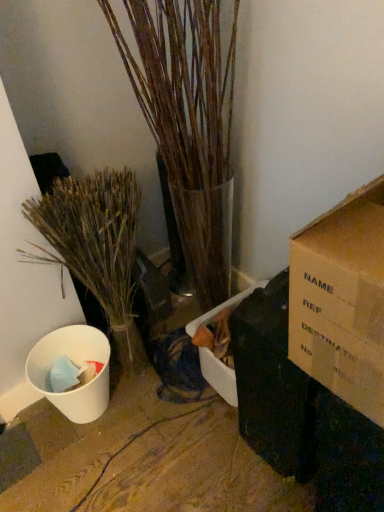
Image resolution: width=384 pixels, height=512 pixels. Describe the element at coordinates (95, 246) in the screenshot. I see `brown textured plant at left` at that location.

At what (x,y) coordinates should I click in order to perform the action: click on brown textured plant at left. Please return your answer as a coordinate pair (x, y). The width and height of the screenshot is (384, 512). Looking at the image, I should click on (95, 246).

Locate an element on the screen. The image size is (384, 512). brown textured plant at left is located at coordinates (95, 246).